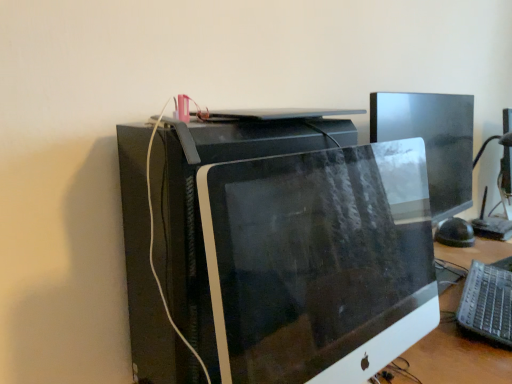
Question: Is silver metallic keyboard at lower right touching matte black monitor at center?

Choices:
 (A) no
 (B) yes

Answer: (A)

Question: Could you tell me if silver metallic keyboard at lower right is turned towards matte black monitor at center?

Choices:
 (A) no
 (B) yes

Answer: (A)

Question: From the image's perspective, is silver metallic keyboard at lower right beneath matte black monitor at center?

Choices:
 (A) yes
 (B) no

Answer: (A)

Question: Is silver metallic keyboard at lower right looking in the opposite direction of matte black monitor at center?

Choices:
 (A) no
 (B) yes

Answer: (A)

Question: Could matte black monitor at center be considered to be inside silver metallic keyboard at lower right?

Choices:
 (A) no
 (B) yes

Answer: (A)

Question: Does silver metallic keyboard at lower right have a smaller size compared to matte black monitor at center?

Choices:
 (A) no
 (B) yes

Answer: (B)

Question: Can you confirm if matte black monitor at center is positioned to the left of silver metallic keyboard at lower right?

Choices:
 (A) no
 (B) yes

Answer: (B)

Question: Does matte black monitor at center lie behind silver metallic keyboard at lower right?

Choices:
 (A) no
 (B) yes

Answer: (A)

Question: Is matte black monitor at center looking in the opposite direction of silver metallic keyboard at lower right?

Choices:
 (A) no
 (B) yes

Answer: (A)

Question: Considering the relative sizes of matte black monitor at center and silver metallic keyboard at lower right in the image provided, is matte black monitor at center taller than silver metallic keyboard at lower right?

Choices:
 (A) yes
 (B) no

Answer: (A)

Question: Considering the relative positions of matte black monitor at center and silver metallic keyboard at lower right in the image provided, is matte black monitor at center to the right of silver metallic keyboard at lower right from the viewer's perspective?

Choices:
 (A) yes
 (B) no

Answer: (B)

Question: Is matte black monitor at center thinner than silver metallic keyboard at lower right?

Choices:
 (A) yes
 (B) no

Answer: (B)

Question: Is silver metallic keyboard at lower right in front of or behind matte black monitor at center in the image?

Choices:
 (A) behind
 (B) front

Answer: (A)